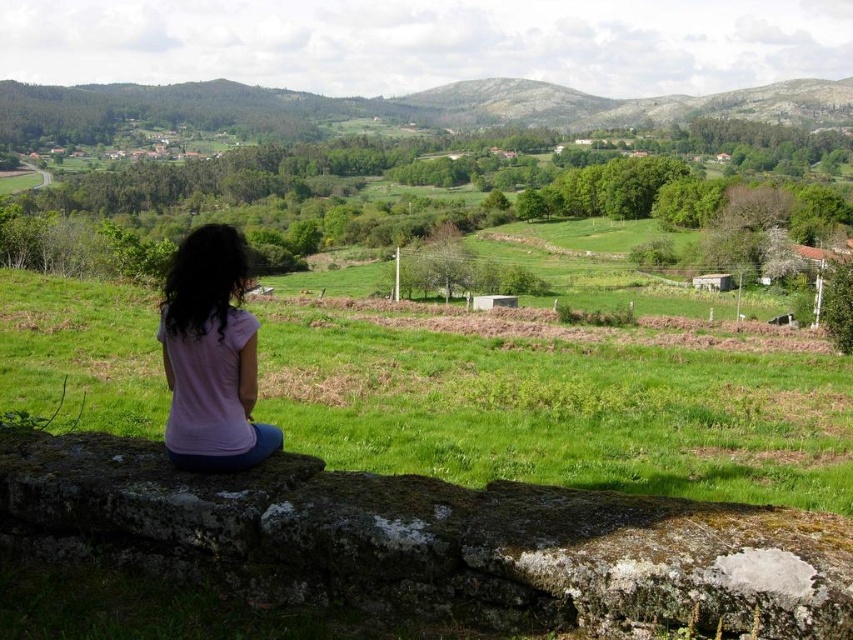
You are standing at the top of a hill overlooking a rural landscape. You see a mossy stone at center and a pink fabric shirt at lower left. Which object is closer to the ground?

The mossy stone at center is closer to the ground because it is positioned below the pink fabric shirt at lower left.

You are standing at the center of the image and want to place a small flag exactly where the mossy stone at center is located. According to the coordinates provided, what are the exact coordinates where you should place the flag?

The mossy stone at center should be flagged at the coordinates point (433,541).

You are standing at the top of a hill overlooking the scene. You notice two items below you. Which one takes up more space in your view? The green grassy field at center or the pink fabric shirt at lower left?

The green grassy field at center takes up more space in your view because it is bigger than the pink fabric shirt at lower left.